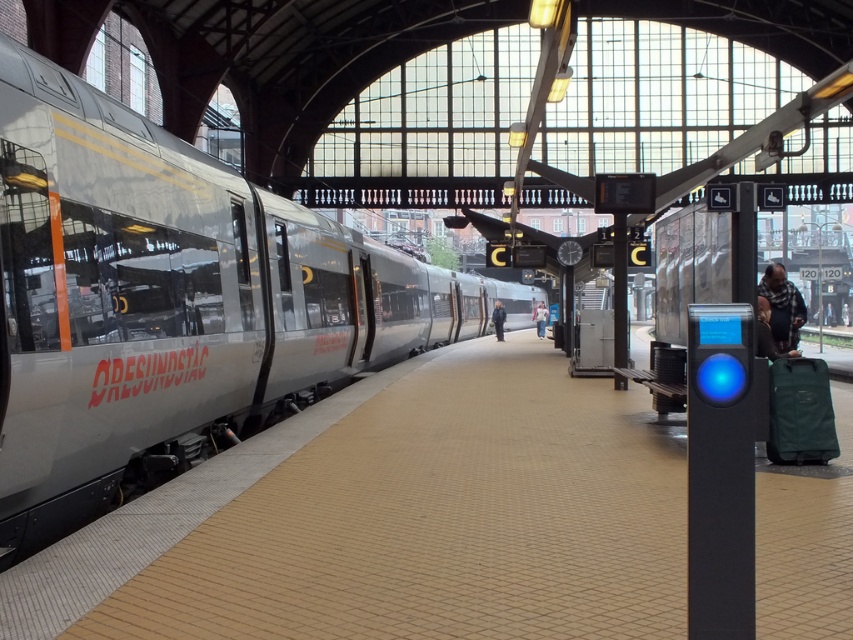
Does dark blue shirt at right have a smaller size compared to dark blue jacket at center?

Indeed, dark blue shirt at right has a smaller size compared to dark blue jacket at center.

Between point (761, 332) and point (502, 310), which one is positioned behind?

The point (502, 310) is behind.

The height and width of the screenshot is (640, 853). Identify the location of dark blue shirt at right. (767, 333).

Does plaid fabric scarf at right appear under light blue denim jacket at center?

Yes, plaid fabric scarf at right is below light blue denim jacket at center.

Locate an element on the screen. The image size is (853, 640). plaid fabric scarf at right is located at coordinates pos(782,307).

Where is `plaid fabric scarf at right`? The image size is (853, 640). plaid fabric scarf at right is located at coordinates (782, 307).

Does point (764, 282) lie in front of point (767, 317)?

That is False.

Can you confirm if plaid fabric scarf at right is positioned below dark blue shirt at right?

No, plaid fabric scarf at right is not below dark blue shirt at right.

The height and width of the screenshot is (640, 853). I want to click on plaid fabric scarf at right, so click(782, 307).

Where is `plaid fabric scarf at right`? plaid fabric scarf at right is located at coordinates (782, 307).